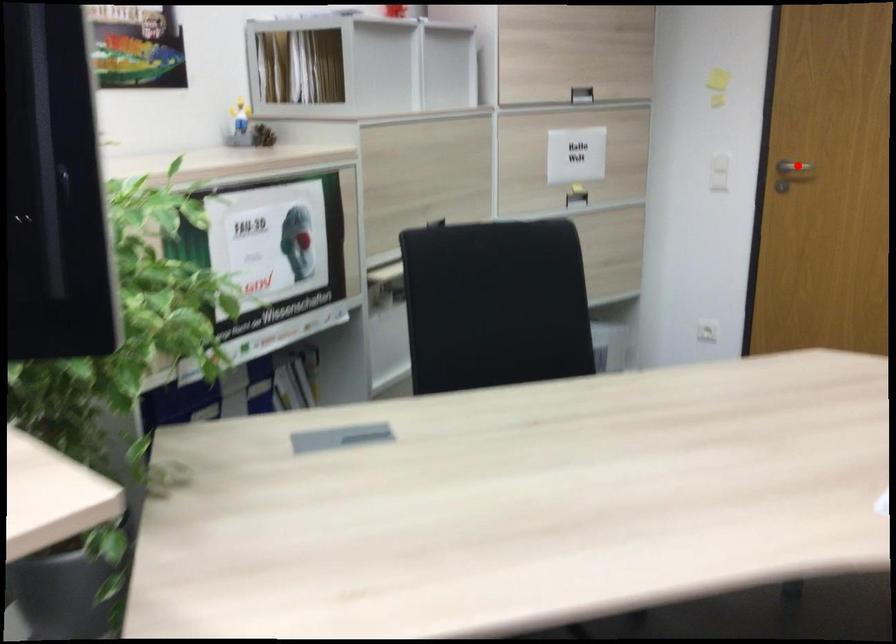
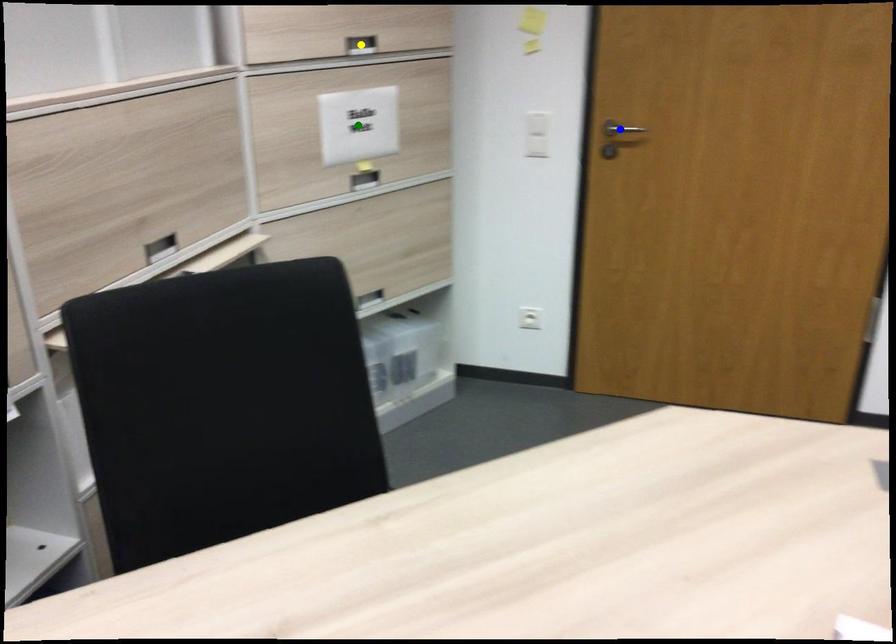
Question: I am providing you with two images of the same scene from different viewpoints. A red point is marked on the first image. You are given multiple points on the second image. Which point in image 2 represents the same 3d spot as the red point in image 1?

Choices:
 (A) yellow point
 (B) blue point
 (C) green point

Answer: (B)